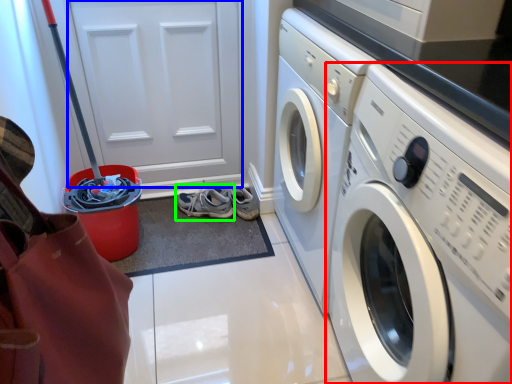
Question: Which object is the farthest from washing machine (highlighted by a red box)? Choose among these: door (highlighted by a blue box) or running shoe (highlighted by a green box).

Choices:
 (A) door
 (B) running shoe

Answer: (A)